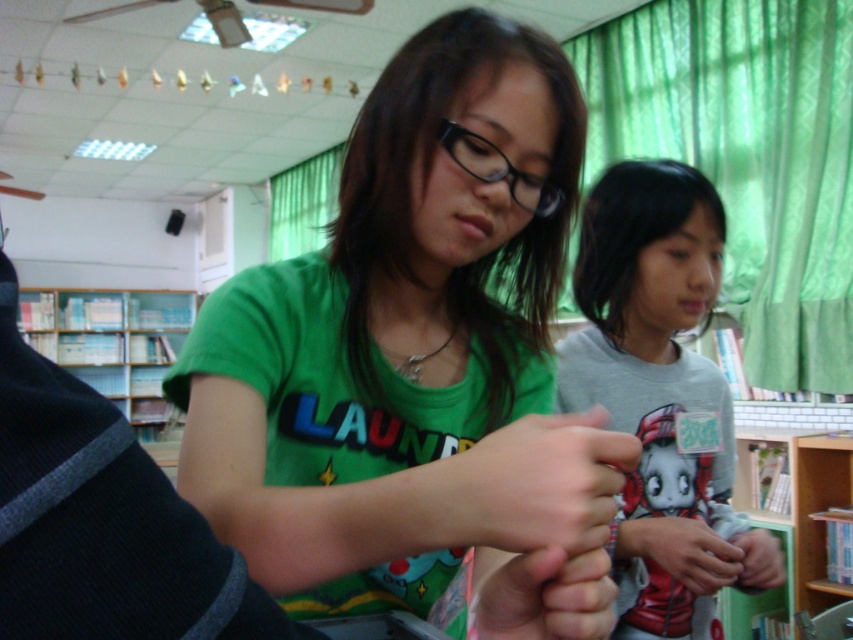
You are standing at the center of the classroom and want to place a new book on the green wooden bookshelf at lower right. Based on the coordinates provided, in which direction should you move to reach the bookshelf?

The green wooden bookshelf at lower right is located at coordinates point (x=792, y=522). Since you are at the center of the classroom, you should move towards the lower right direction to reach the bookshelf.